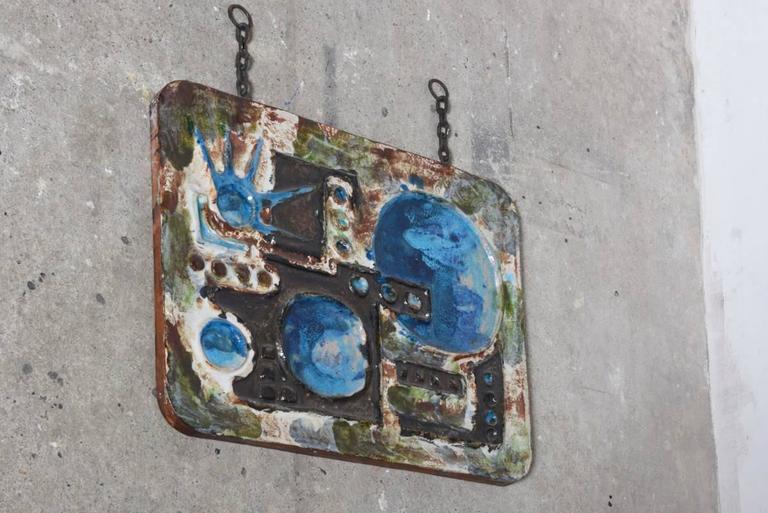
Identify the location of wall. The width and height of the screenshot is (768, 513). (64, 194).